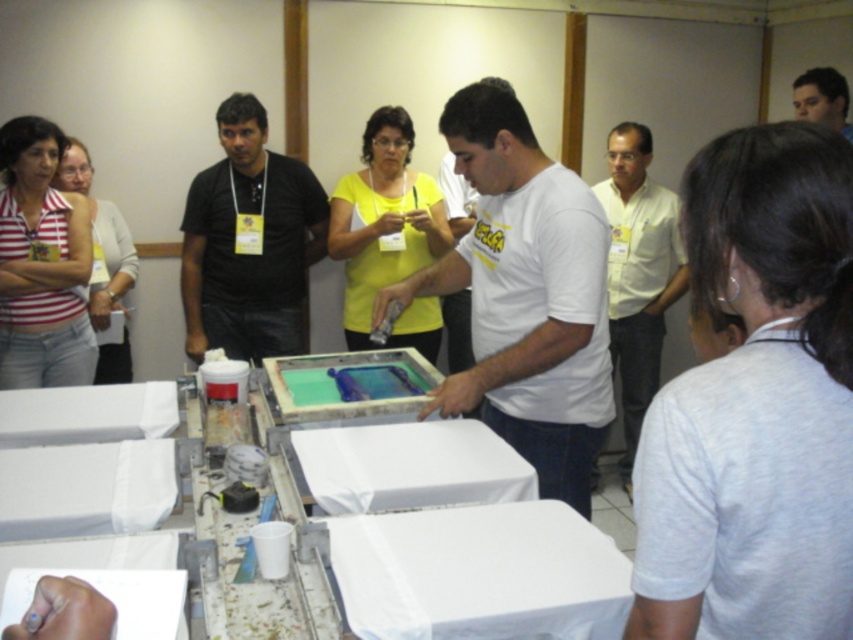
Question: Which object is positioned farthest from the striped cotton tank top at left?

Choices:
 (A) translucent plastic tray at center
 (B) smooth skin face at upper right
 (C) black matte shirt at center
 (D) white paper at center

Answer: (B)

Question: Which object is closer to the camera taking this photo?

Choices:
 (A) smooth skin face at upper right
 (B) striped cotton tank top at left
 (C) white matte t-shirt at center
 (D) white paper at center

Answer: (D)

Question: Does white shirt at center have a smaller size compared to translucent plastic tray at center?

Choices:
 (A) no
 (B) yes

Answer: (A)

Question: Is white paper at center closer to camera compared to translucent plastic tray at center?

Choices:
 (A) no
 (B) yes

Answer: (B)

Question: Which point is closer to the camera?

Choices:
 (A) (799, 100)
 (B) (54, 592)

Answer: (B)

Question: Does white matte t-shirt at center appear on the right side of smooth skin face at upper right?

Choices:
 (A) yes
 (B) no

Answer: (B)